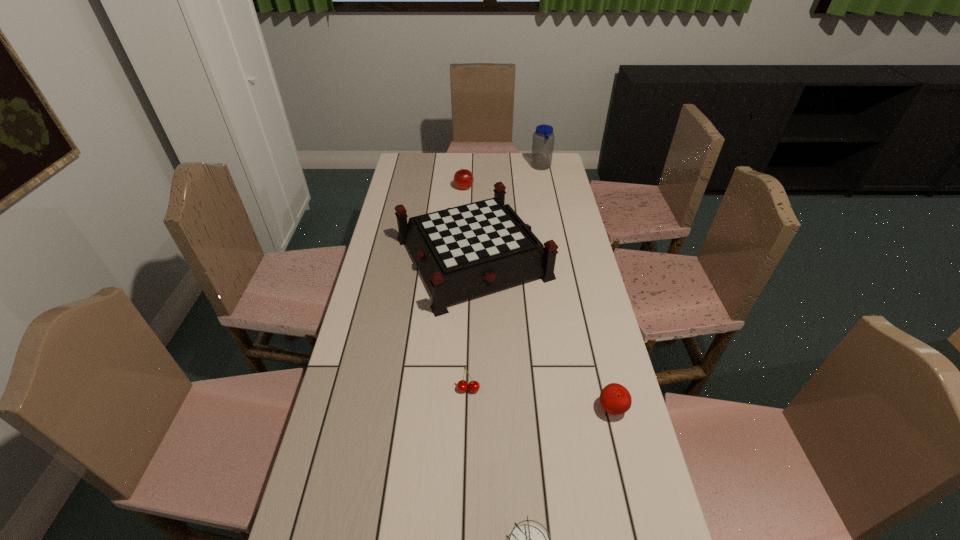
Locate an element on the screen. vacant space located with a carrying loop on the side of the tallest object is located at coordinates (499, 167).

I want to click on free point located 0.270m with a carrying loop on the side of the tallest object, so tap(475, 167).

At what (x,y) coordinates should I click in order to perform the action: click on vacant region located 0.370m on the front of the fourth nearest object. Please return your answer as a coordinate pair (x, y). Looking at the image, I should click on (469, 423).

At what (x,y) coordinates should I click in order to perform the action: click on vacant space located 0.210m on the back of the left apple. Please return your answer as a coordinate pair (x, y). The width and height of the screenshot is (960, 540). Looking at the image, I should click on (466, 160).

I want to click on free point located 0.330m with the stems of the cherry pointing upwards, so click(466, 526).

Image resolution: width=960 pixels, height=540 pixels. Identify the location of free space located on the front of the nearer apple. (624, 460).

Image resolution: width=960 pixels, height=540 pixels. In order to click on object that is at the far edge in this screenshot , I will do `click(543, 138)`.

I want to click on object present at the left edge, so click(x=462, y=252).

This screenshot has height=540, width=960. Identify the location of water bottle situated at the right edge. (543, 138).

You are a GUI agent. You are given a task and a screenshot of the screen. Output one action in this format:
    pyautogui.click(x=<x>, y=<y>)
    Task: Click on the checkerboard that is at the right edge
    
    Given the screenshot: What is the action you would take?
    pyautogui.click(x=462, y=252)